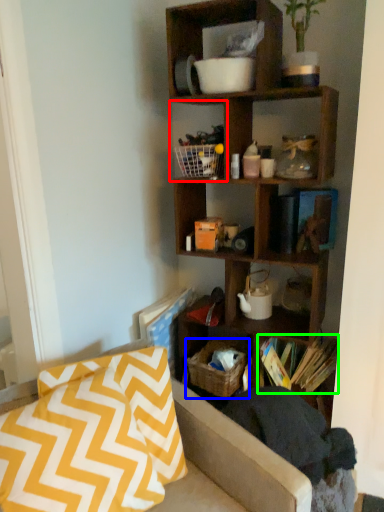
Question: Which object is the farthest from cabinet (highlighted by a red box)? Choose among these: crate (highlighted by a blue box) or book (highlighted by a green box).

Choices:
 (A) crate
 (B) book

Answer: (B)